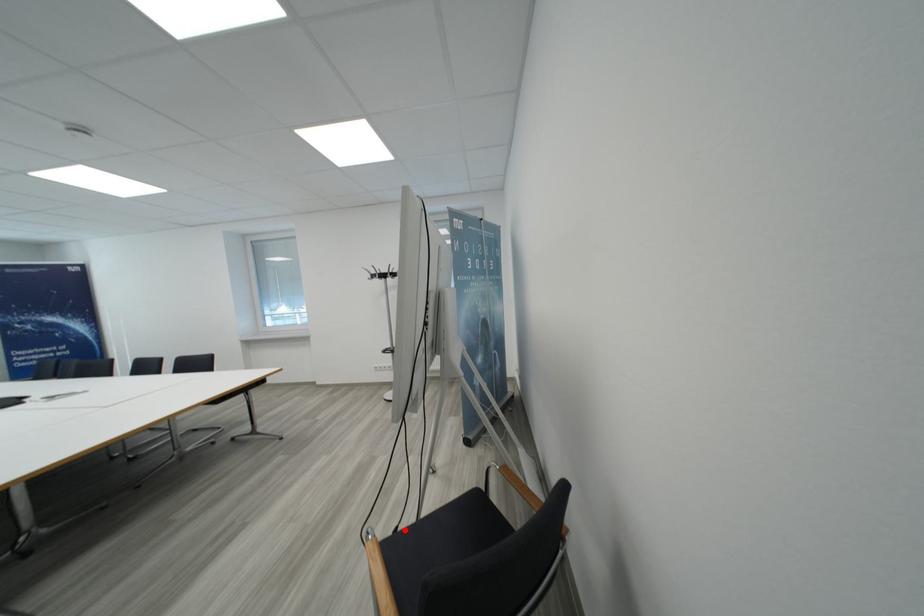
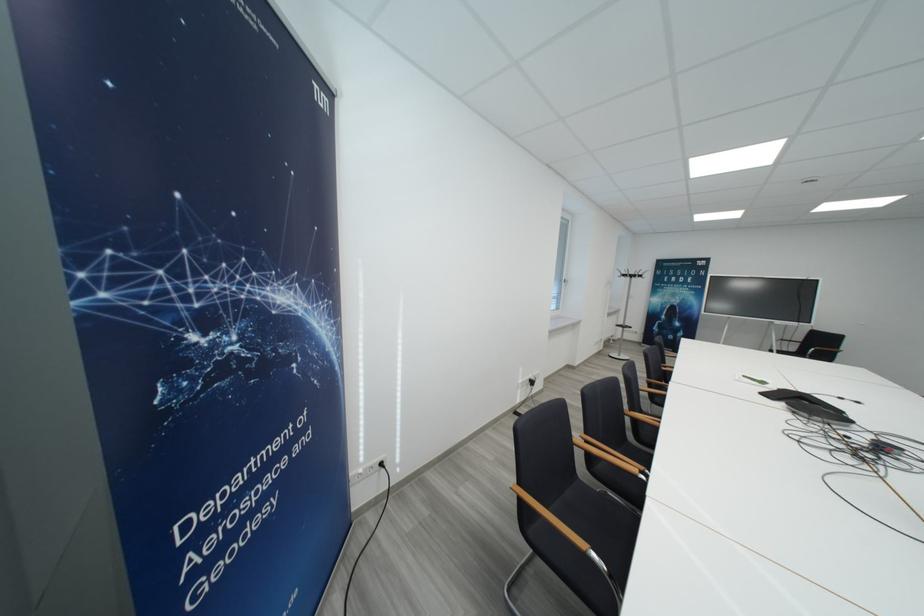
Question: I am providing you with two images of the same scene from different viewpoints. A red point is marked on the first image. Can you still see the location of the red point in image 2?

Choices:
 (A) Yes
 (B) No

Answer: (B)